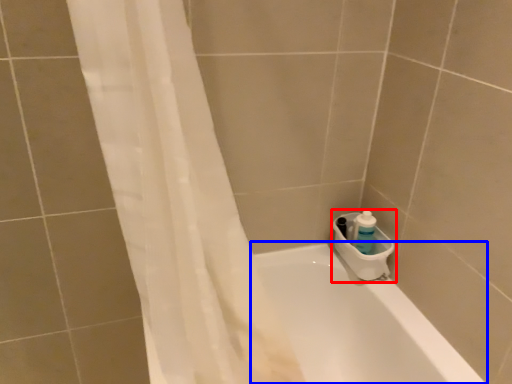
Question: Which of the following is the closest to the observer, sink (highlighted by a red box) or bathtub (highlighted by a blue box)?

Choices:
 (A) sink
 (B) bathtub

Answer: (B)